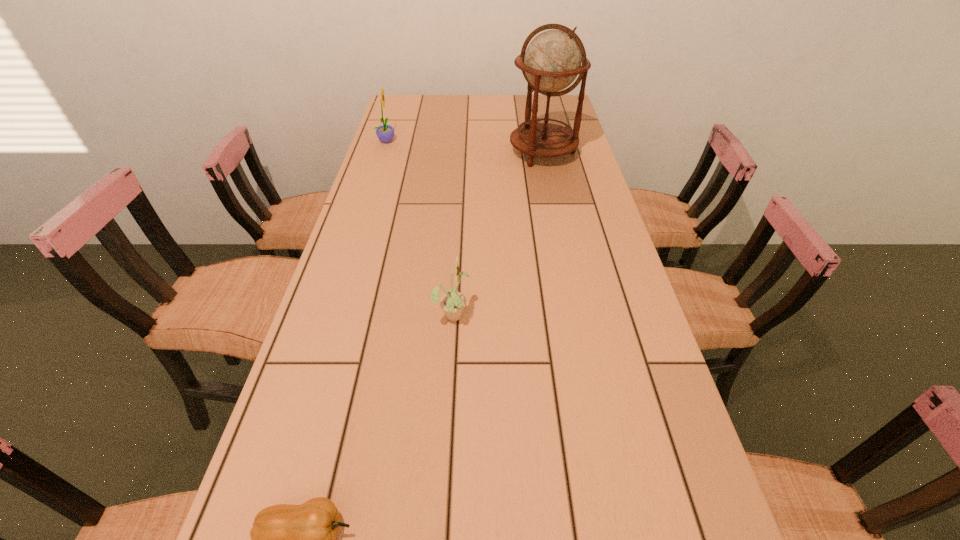
Identify the location of vacant space at the far edge. The image size is (960, 540). (446, 106).

Identify the location of vacant area at the left edge. The image size is (960, 540). (344, 497).

Find the location of a particular element. free space at the right edge of the desktop is located at coordinates (646, 479).

This screenshot has height=540, width=960. In order to click on vacant space at the far left corner of the desktop in this screenshot , I will do `click(394, 106)`.

In the image, there is a desktop. Where is `vacant space at the far right corner`? This screenshot has height=540, width=960. vacant space at the far right corner is located at coordinates (541, 112).

Locate an element on the screen. unoccupied position between the farther sunflower and the second object from right to left is located at coordinates (420, 227).

Locate an element on the screen. The width and height of the screenshot is (960, 540). vacant area that lies between the left sunflower and the globe is located at coordinates (465, 147).

At what (x,y) coordinates should I click in order to perform the action: click on empty location between the rightmost object and the right sunflower. Please return your answer as a coordinate pair (x, y). Looking at the image, I should click on (497, 233).

Image resolution: width=960 pixels, height=540 pixels. Find the location of `vacant region between the left sunflower and the third farthest object`. vacant region between the left sunflower and the third farthest object is located at coordinates (420, 227).

This screenshot has width=960, height=540. I want to click on free space between the rightmost object and the third farthest object, so click(497, 233).